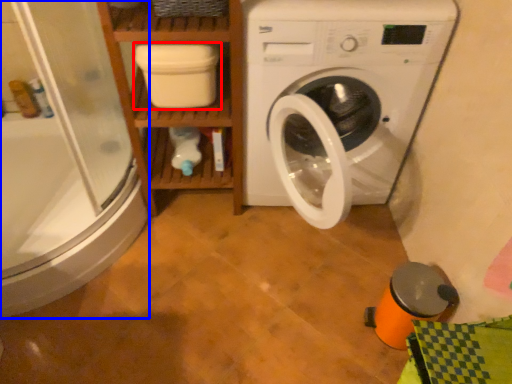
Question: Which object appears farthest to the camera in this image, dish washer (highlighted by a red box) or shower door (highlighted by a blue box)?

Choices:
 (A) dish washer
 (B) shower door

Answer: (A)